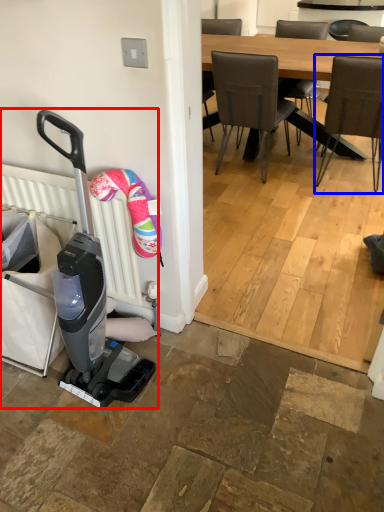
Question: Among these objects, which one is nearest to the camera, baby carriage (highlighted by a red box) or chair (highlighted by a blue box)?

Choices:
 (A) baby carriage
 (B) chair

Answer: (A)